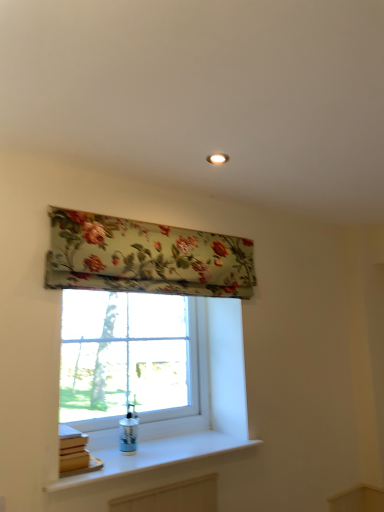
Question: Relative to floral fabric window blind at upper center, is white smooth window sill at lower center in front or behind?

Choices:
 (A) front
 (B) behind

Answer: (A)

Question: Choose the correct answer: Is white smooth window sill at lower center inside floral fabric window blind at upper center or outside it?

Choices:
 (A) outside
 (B) inside

Answer: (A)

Question: Which of these objects is positioned closest to the white smooth window sill at lower center?

Choices:
 (A) floral fabric window blind at upper center
 (B) clear glass window at center

Answer: (B)

Question: Which object is the closest to the clear glass window at center?

Choices:
 (A) white smooth window sill at lower center
 (B) floral fabric window blind at upper center

Answer: (A)